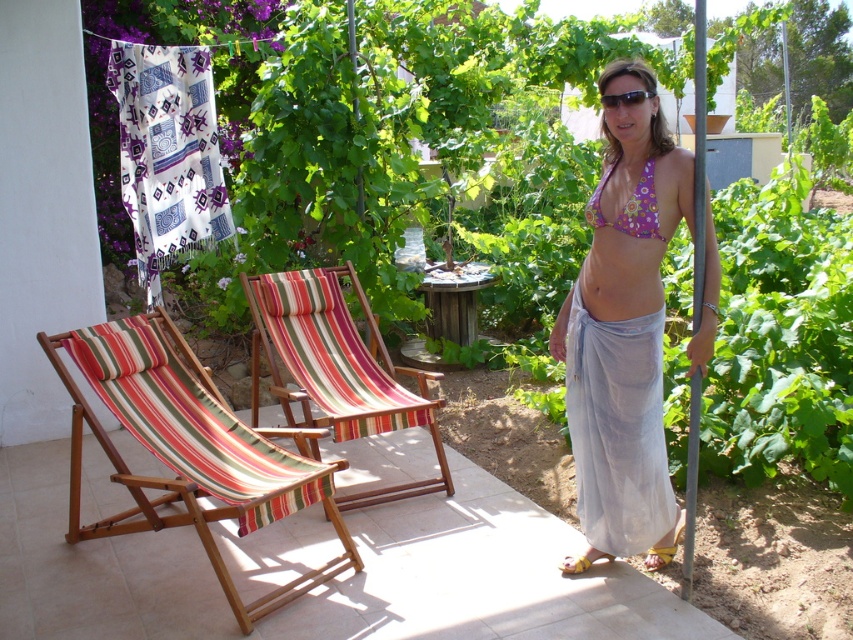
Can you confirm if striped fabric beach chair at center is bigger than yellow fabric sandal at lower right?

Yes.

Can you confirm if striped fabric beach chair at center is taller than yellow fabric sandal at lower right?

Correct, striped fabric beach chair at center is much taller as yellow fabric sandal at lower right.

Is point (257, 333) more distant than point (599, 556)?

That is True.

Where is `striped fabric beach chair at center`? striped fabric beach chair at center is located at coordinates (338, 368).

Does floral bikini top at center have a smaller size compared to translucent white bikini bottom at right?

No.

Can you confirm if floral bikini top at center is positioned to the left of translucent white bikini bottom at right?

Incorrect, floral bikini top at center is not on the left side of translucent white bikini bottom at right.

Does point (645, 451) come behind point (654, 452)?

No, (645, 451) is closer to viewer.

Locate an element on the screen. This screenshot has height=640, width=853. floral bikini top at center is located at coordinates (624, 337).

How much distance is there between striped fabric beach chair at center and floral print fabric bikini top at upper right?

striped fabric beach chair at center and floral print fabric bikini top at upper right are 1.70 meters apart.

Does striped fabric beach chair at center have a greater height compared to floral print fabric bikini top at upper right?

Yes, striped fabric beach chair at center is taller than floral print fabric bikini top at upper right.

Who is more forward, (439, 452) or (654, 236)?

Point (654, 236)

This screenshot has height=640, width=853. Identify the location of striped fabric beach chair at center. (338, 368).